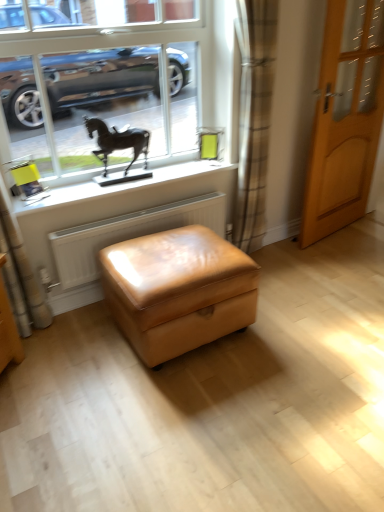
The width and height of the screenshot is (384, 512). In order to click on vacant space underneath light brown wooden door at right (from a real-world perspective) in this screenshot , I will do `click(334, 233)`.